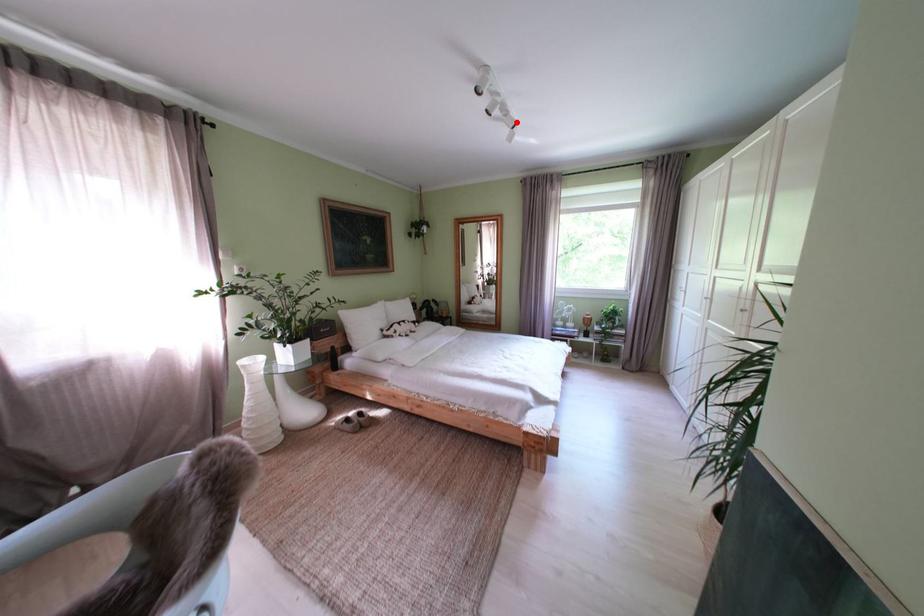
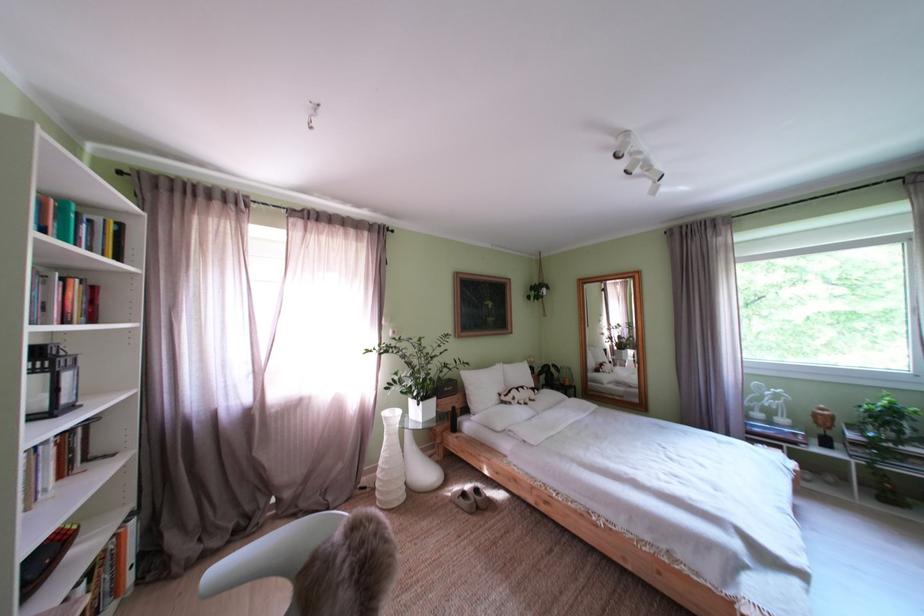
Question: I am providing you with two images of the same scene from different viewpoints. A red point is marked on the first image. Is the red point's position out of view in image 2?

Choices:
 (A) Yes
 (B) No

Answer: (B)